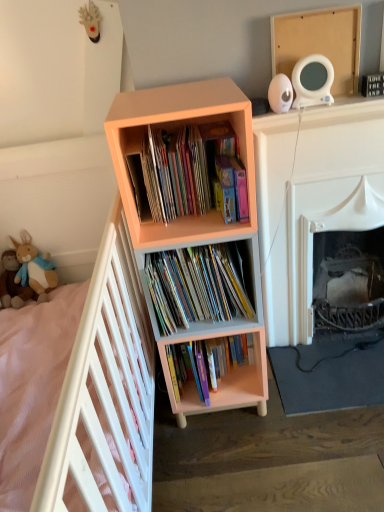
Question: In terms of width, does soft plush toy at left, the first toy positioned from the left, look wider or thinner when compared to white wooden bed at left?

Choices:
 (A) thin
 (B) wide

Answer: (A)

Question: From a real-world perspective, relative to white wooden bed at left, is soft plush toy at left, the first toy positioned from the left, vertically above or below?

Choices:
 (A) above
 (B) below

Answer: (A)

Question: Considering the real-world distances, which object is farthest from the soft plush toy at left, the first toy positioned from the left?

Choices:
 (A) white wooden bed at left
 (B) peach matte bookcase at center
 (C) matte cardboard books at center, which is the 2th book in bottom-to-top order
 (D) hardcover books at center, the 3th book viewed from the top
 (E) brown plush toy at lower left, which appears as the 1th toy when viewed from the right

Answer: (B)

Question: Which object is positioned farthest from the matte pink bookshelf at center, which is the third book from bottom to top?

Choices:
 (A) brown plush toy at lower left, which appears as the 1th toy when viewed from the right
 (B) matte cardboard books at center, which is the 2th book in bottom-to-top order
 (C) peach matte bookcase at center
 (D) white wooden bed at left
 (E) hardcover books at center, the first book when ordered from bottom to top

Answer: (A)